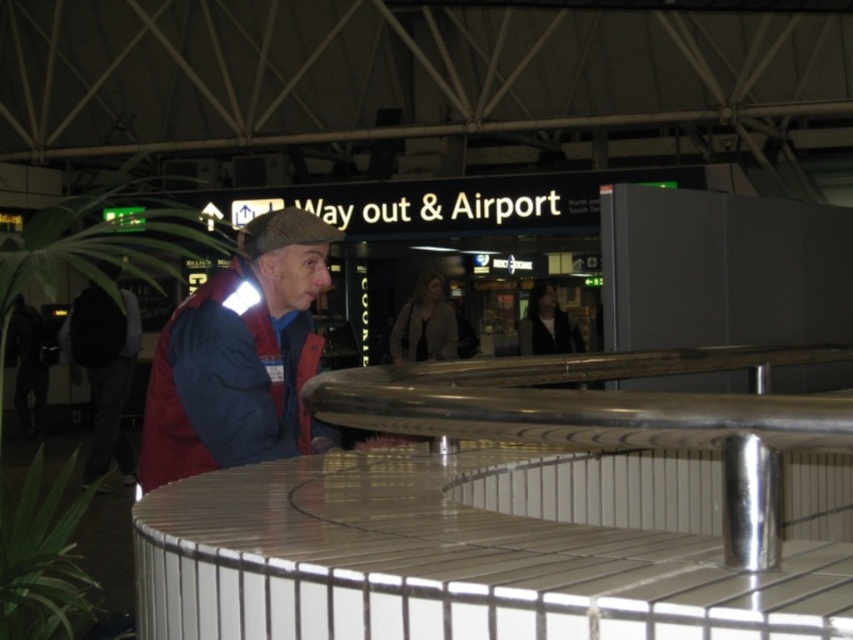
Is matte red jacket at center wider than dark blue jacket at center?

No.

Does point (247, 374) lie behind point (77, 298)?

No, it is not.

This screenshot has width=853, height=640. What are the coordinates of `matte red jacket at center` in the screenshot? It's located at coord(239,356).